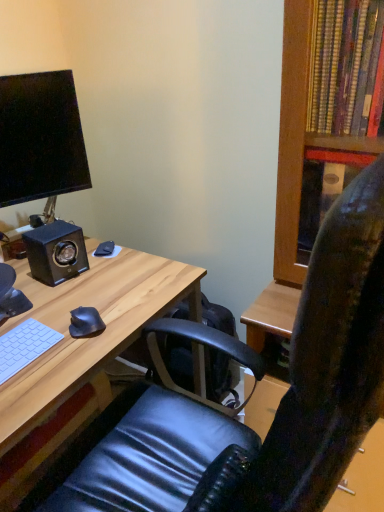
Locate an element on the screen. vacant space in front of black matte speaker at left is located at coordinates (53, 300).